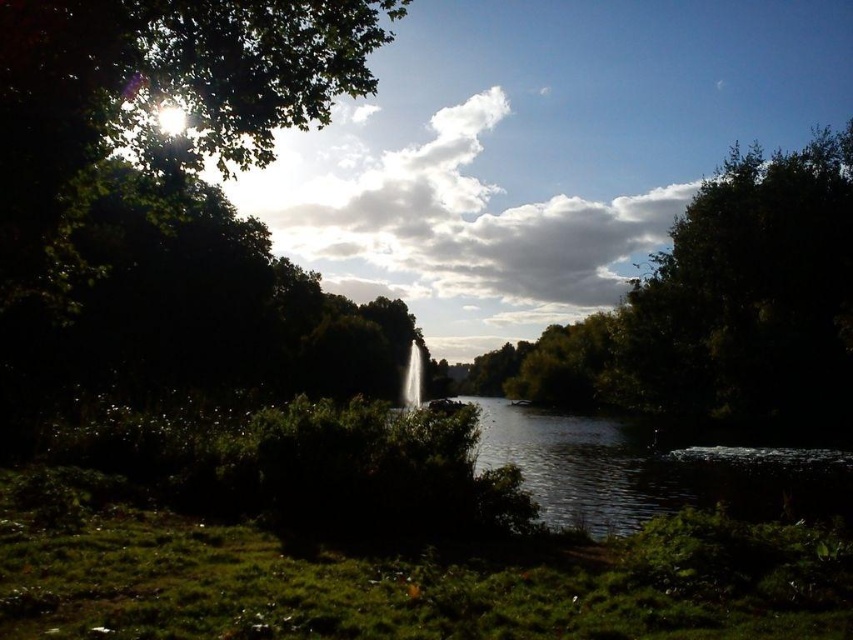
Is point (535, 273) closer to camera compared to point (819, 474)?

No, it is behind (819, 474).

You are a GUI agent. You are given a task and a screenshot of the screen. Output one action in this format:
    pyautogui.click(x=<x>, y=<y>)
    Task: Click on the white fluffy cloud at upper center
    
    Given the screenshot: What is the action you would take?
    pyautogui.click(x=451, y=218)

Can you confirm if green leafy tree at upper right is positioned to the right of dark reflective water at center?

Correct, you'll find green leafy tree at upper right to the right of dark reflective water at center.

Does point (728, 406) come closer to viewer compared to point (659, 486)?

No, (728, 406) is behind (659, 486).

I want to click on green leafy tree at upper right, so click(718, 310).

Is green leafy tree at upper right positioned behind white fluffy cloud at upper center?

No, green leafy tree at upper right is closer to the viewer.

Is point (717, 189) positioned behind point (447, 125)?

No, (717, 189) is in front of (447, 125).

You are a GUI agent. You are given a task and a screenshot of the screen. Output one action in this format:
    pyautogui.click(x=<x>, y=<y>)
    Task: Click on the green leafy tree at upper right
    
    Given the screenshot: What is the action you would take?
    pyautogui.click(x=718, y=310)